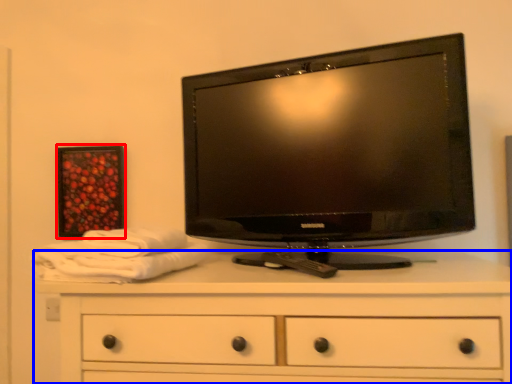
Question: Which of the following is the farthest to the observer, picture frame (highlighted by a red box) or chest of drawers (highlighted by a blue box)?

Choices:
 (A) picture frame
 (B) chest of drawers

Answer: (A)